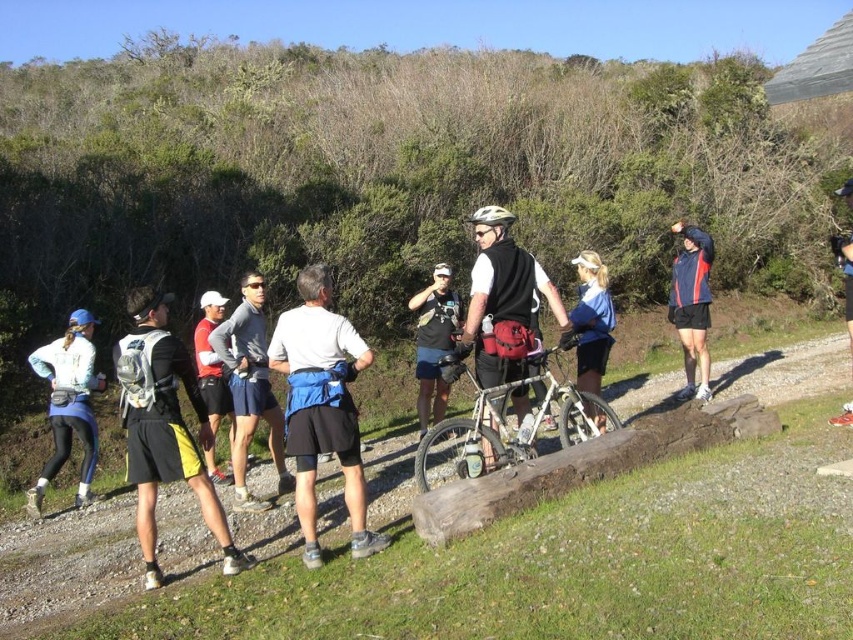
Who is lower down, matte blue jacket at upper right or blue fabric shirt at center?

matte blue jacket at upper right is lower down.

Describe the element at coordinates (691, 305) in the screenshot. I see `matte blue jacket at upper right` at that location.

At what (x,y) coordinates should I click in order to perform the action: click on matte blue jacket at upper right. Please return your answer as a coordinate pair (x, y). Looking at the image, I should click on (691, 305).

Who is lower down, matte black vest at center or matte blue jacket at upper right?

matte black vest at center

Does matte black vest at center appear on the left side of matte blue jacket at upper right?

Indeed, matte black vest at center is positioned on the left side of matte blue jacket at upper right.

This screenshot has width=853, height=640. Find the location of `matte black vest at center`. matte black vest at center is located at coordinates (503, 292).

Can you confirm if matte black shorts at left is thinner than blue fabric shirt at center?

No.

Can you confirm if matte black shorts at left is bigger than blue fabric shirt at center?

Yes, matte black shorts at left is bigger than blue fabric shirt at center.

Is point (816, 570) less distant than point (602, 266)?

Yes, it is.

Find the location of a particular element. This screenshot has height=640, width=853. matte black shorts at left is located at coordinates (496, 548).